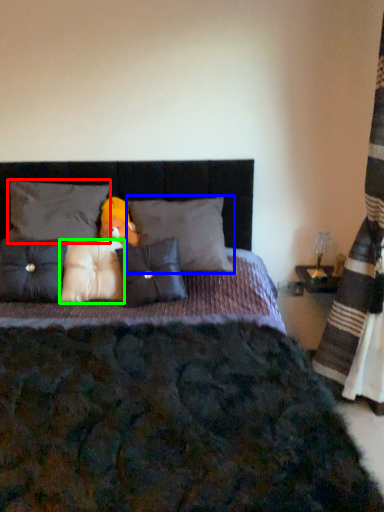
Question: Based on their relative distances, which object is nearer to pillow (highlighted by a red box)? Choose from pillow (highlighted by a blue box) and pillow (highlighted by a green box).

Choices:
 (A) pillow
 (B) pillow

Answer: (B)